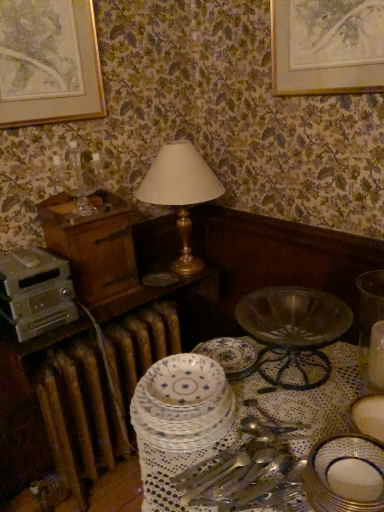
Where is `free region on the left part of translucent glass bowl at lower right`? free region on the left part of translucent glass bowl at lower right is located at coordinates (322, 392).